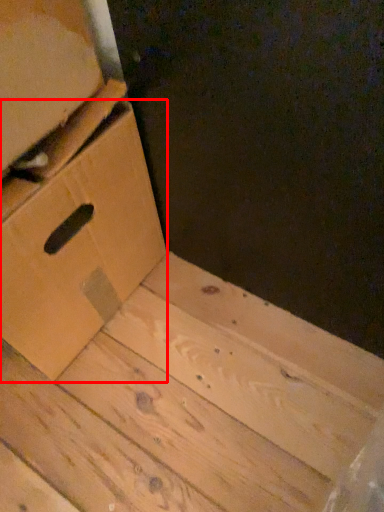
Question: From the image's perspective, where is drawer (annotated by the red box) located in relation to cardboard box in the image?

Choices:
 (A) below
 (B) above

Answer: (A)